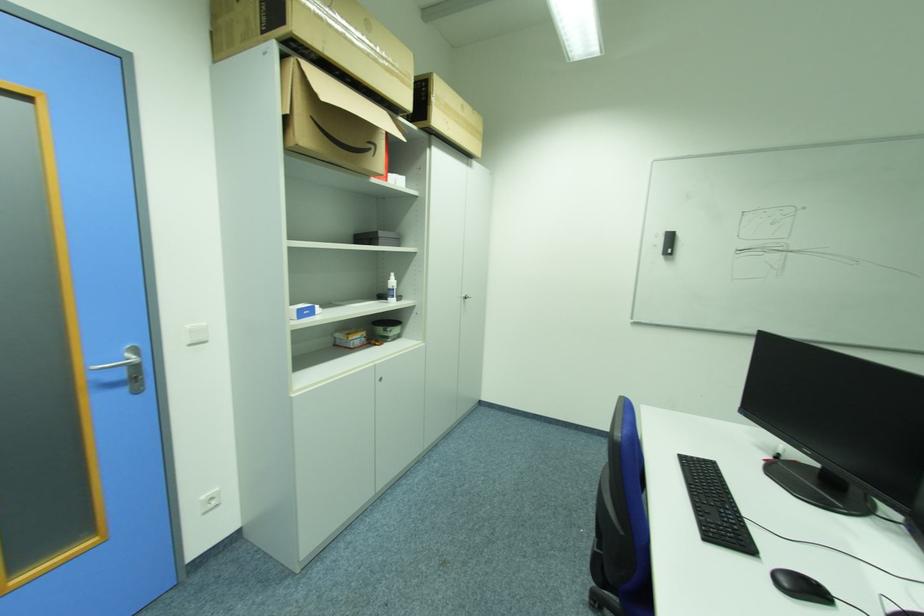
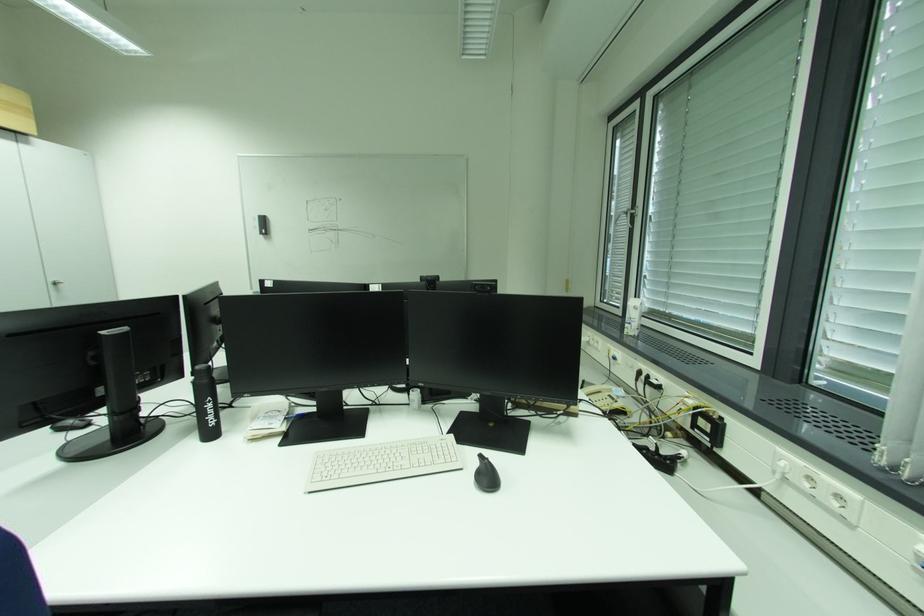
The images are taken continuously from a first-person perspective. In which direction are you moving?

The movement direction of the cameraman is right, backward.